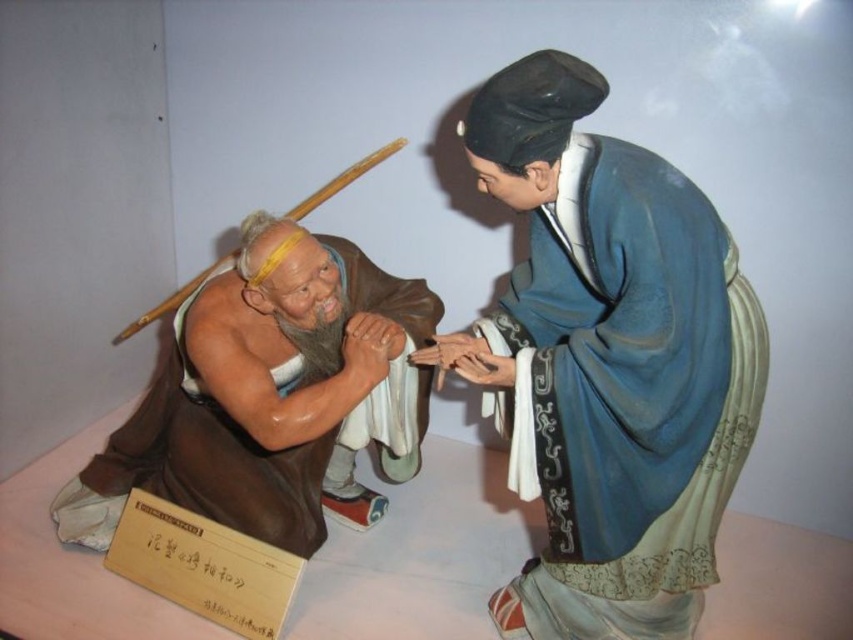
Question: Is blue silk robe at upper right below brown matte statue at left?

Choices:
 (A) yes
 (B) no

Answer: (B)

Question: Which of the following is the closest to the observer?

Choices:
 (A) (566, 433)
 (B) (245, 417)

Answer: (A)

Question: From the image, what is the correct spatial relationship of blue silk robe at upper right in relation to brown matte statue at left?

Choices:
 (A) above
 (B) below

Answer: (A)

Question: Is the position of blue silk robe at upper right more distant than that of brown matte statue at left?

Choices:
 (A) no
 (B) yes

Answer: (A)